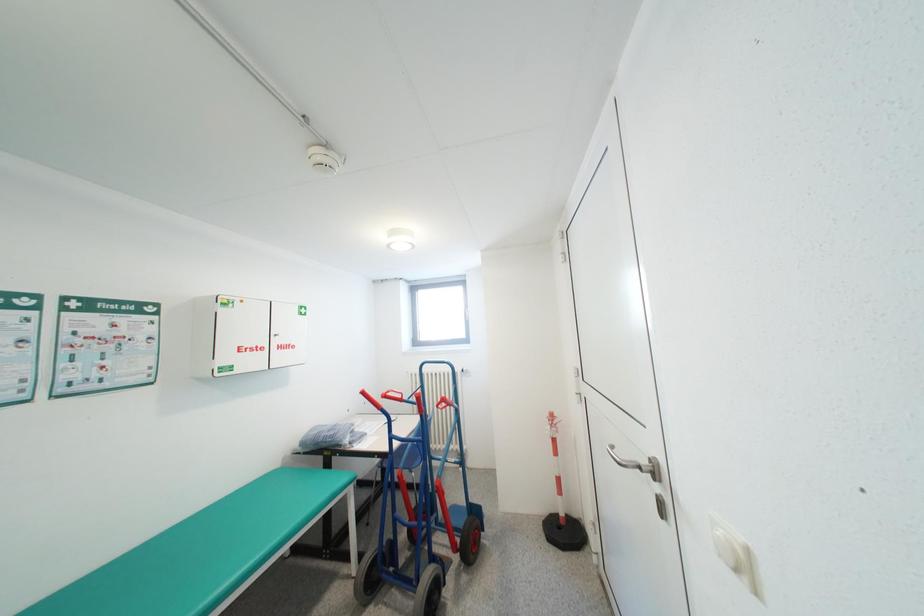
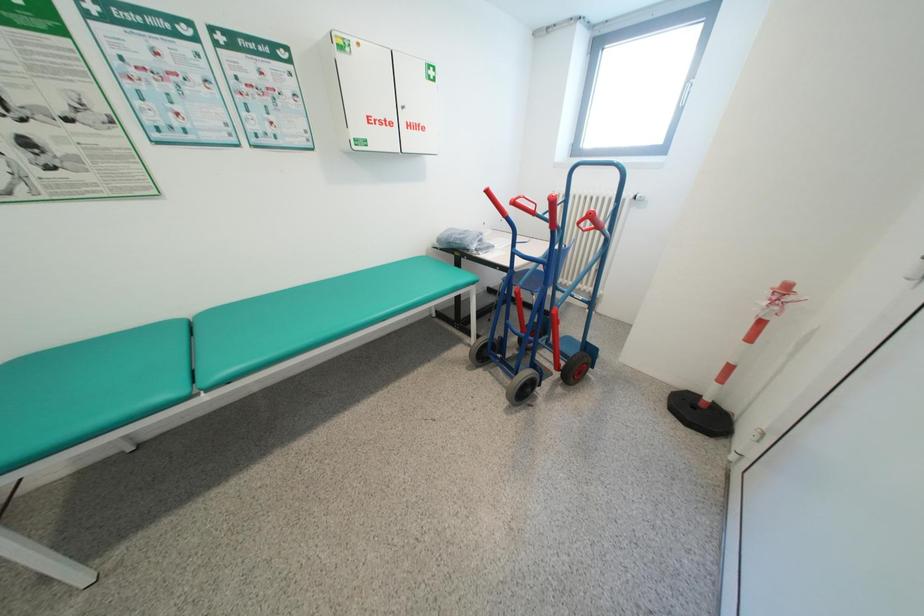
The images are taken continuously from a first-person perspective. In which direction is your viewpoint rotating?

The camera's rotation is toward left-down.